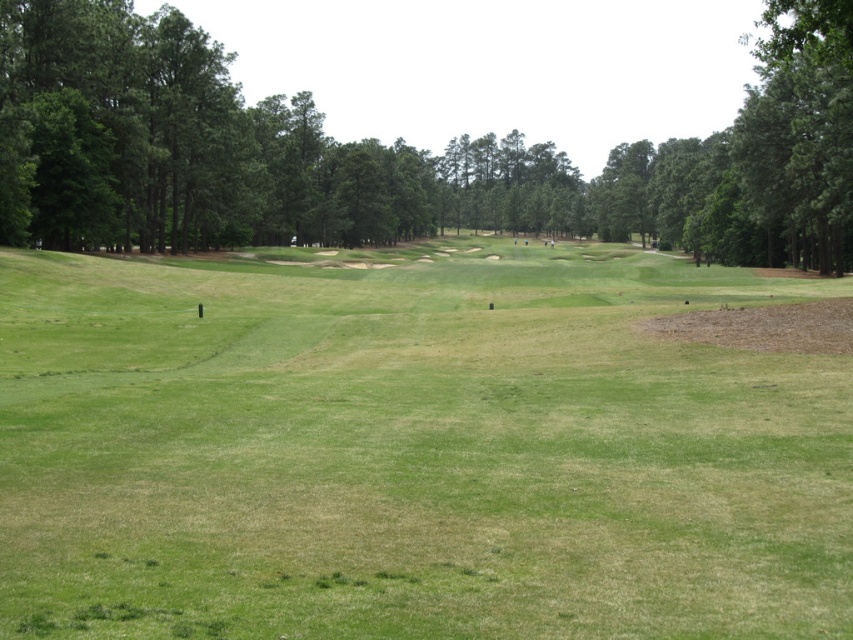
Question: Which point is closer to the camera?

Choices:
 (A) (824, 228)
 (B) (368, 540)

Answer: (B)

Question: From the image, what is the correct spatial relationship of green grassy field at center in relation to green leafy tree at center?

Choices:
 (A) below
 (B) above

Answer: (A)

Question: Which point is farther to the camera?

Choices:
 (A) green grassy field at center
 (B) green leafy tree at center

Answer: (B)

Question: Is green grassy field at center to the left of green leafy tree at center from the viewer's perspective?

Choices:
 (A) no
 (B) yes

Answer: (B)

Question: Does green grassy field at center have a larger size compared to green leafy tree at center?

Choices:
 (A) no
 (B) yes

Answer: (A)

Question: Which point is farther to the camera?

Choices:
 (A) green grassy field at center
 (B) green leafy tree at center

Answer: (B)